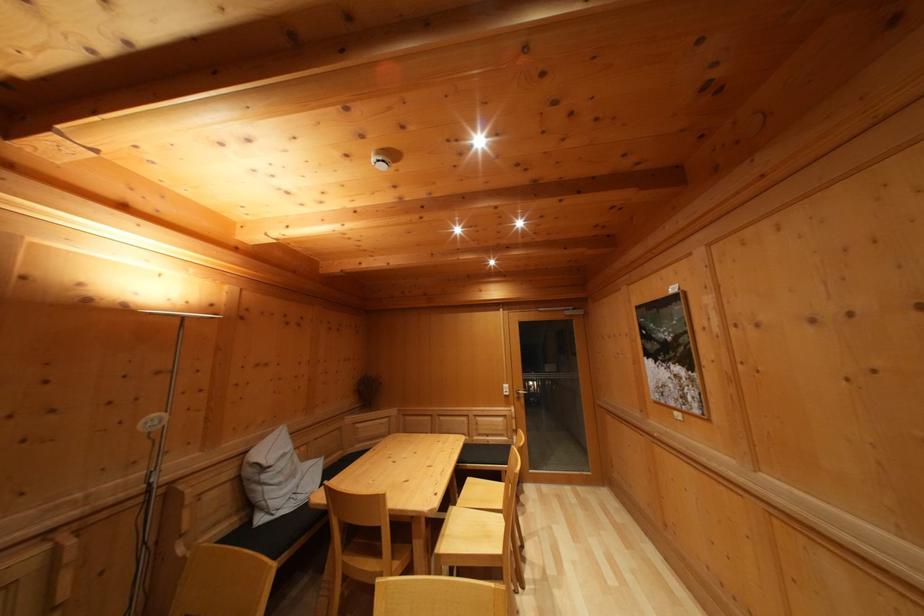
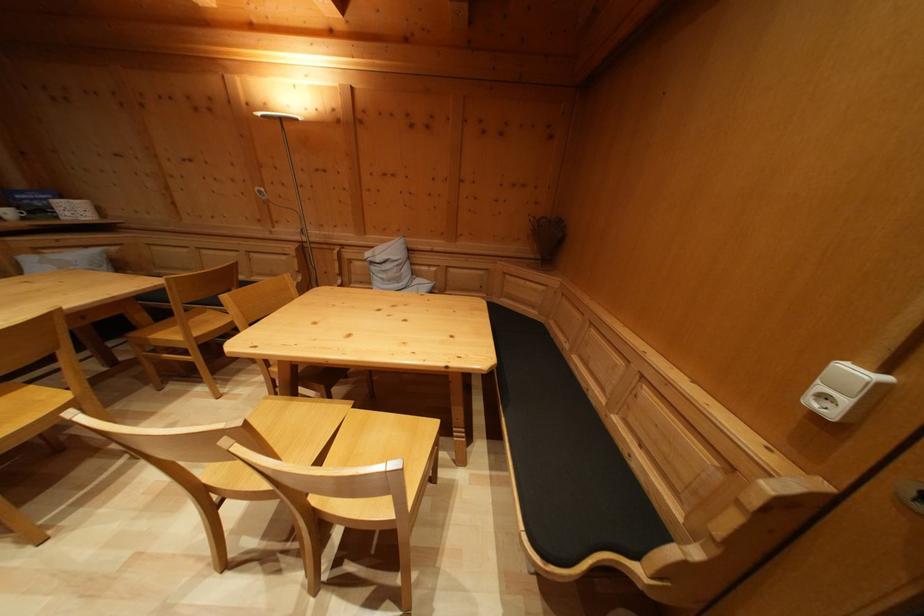
Locate, in the second image, the point that corresponds to (512,392) in the first image.

(859, 379)